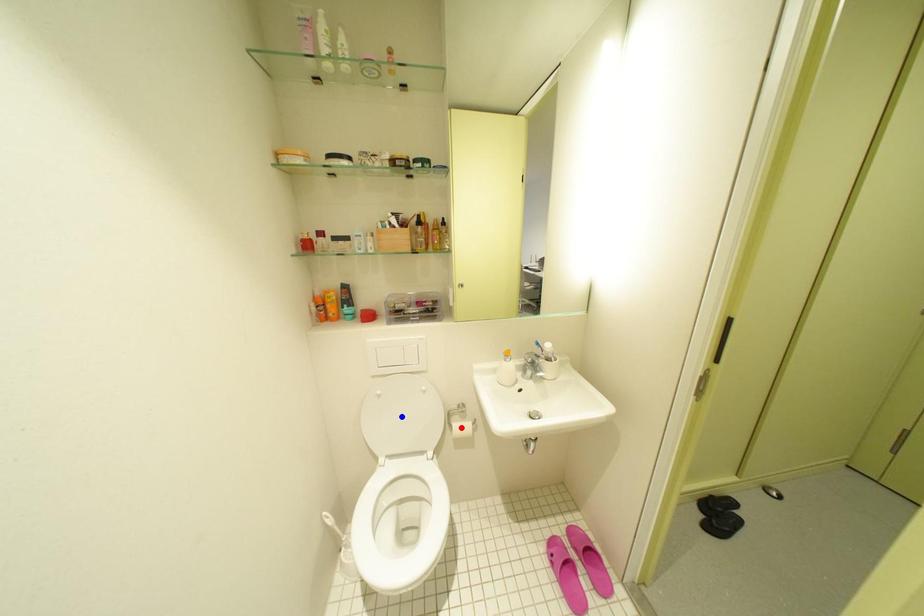
Order these from nearest to farthest:
1. blue point
2. red point
3. orange point

red point
blue point
orange point